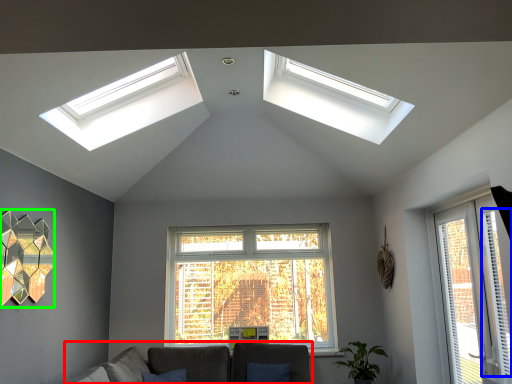
Question: Which is nearer to the couch (highlighted by a red box)? curtain (highlighted by a blue box) or lamp (highlighted by a green box).

Choices:
 (A) curtain
 (B) lamp

Answer: (B)